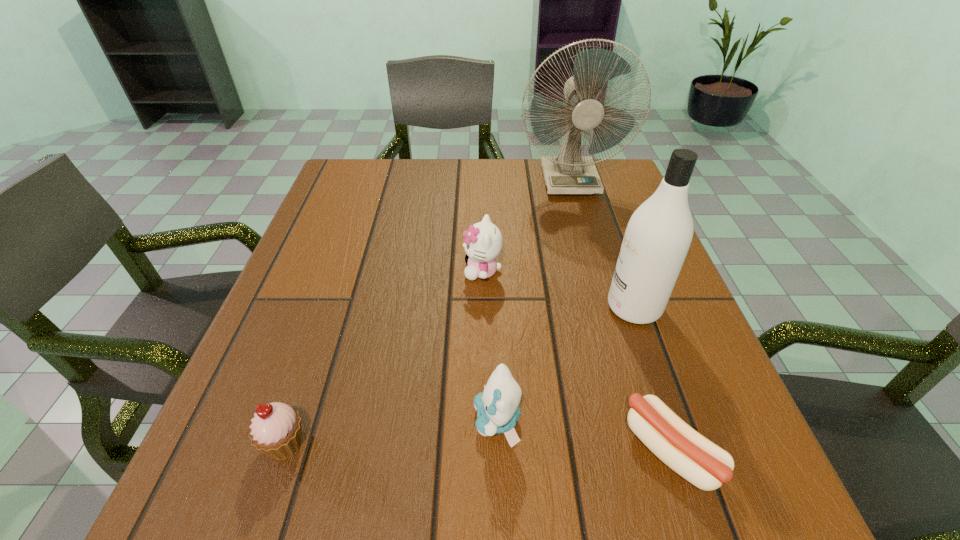
At what (x,y) coordinates should I click in order to perform the action: click on blank space located on the front-facing side of the farther kitten. Please return your answer as a coordinate pair (x, y). Looking at the image, I should click on (357, 271).

Locate an element on the screen. vacant space located on the front-facing side of the farther kitten is located at coordinates (420, 271).

The height and width of the screenshot is (540, 960). Find the location of `vacant position located 0.140m on the front-facing side of the farther kitten`. vacant position located 0.140m on the front-facing side of the farther kitten is located at coordinates (396, 271).

Locate an element on the screen. The height and width of the screenshot is (540, 960). free space located 0.170m on the face of the nearer kitten is located at coordinates (361, 421).

The image size is (960, 540). Find the location of `vacant space situated on the face of the nearer kitten`. vacant space situated on the face of the nearer kitten is located at coordinates (288, 421).

You are a GUI agent. You are given a task and a screenshot of the screen. Output one action in this format:
    pyautogui.click(x=<x>, y=<y>)
    Task: Click on the vacant region located 0.230m on the face of the nearer kitten
    The width and height of the screenshot is (960, 540).
    Given the screenshot: What is the action you would take?
    pyautogui.click(x=322, y=421)

What are the coordinates of `blank space located 0.100m on the back of the leftmost object` in the screenshot? It's located at (311, 367).

This screenshot has width=960, height=540. What are the coordinates of `free space located 0.300m on the left of the shortest object` in the screenshot? It's located at (419, 451).

This screenshot has height=540, width=960. I want to click on object present at the far edge, so click(568, 173).

Find the location of a particular element. cupcake at the near edge is located at coordinates (276, 431).